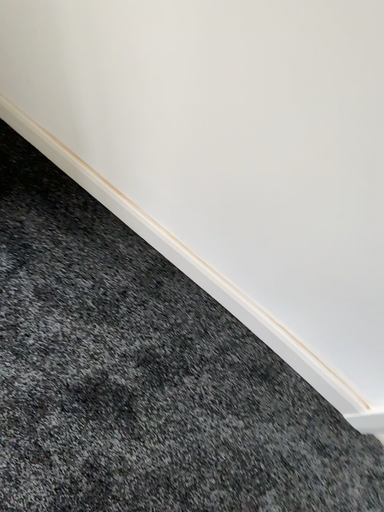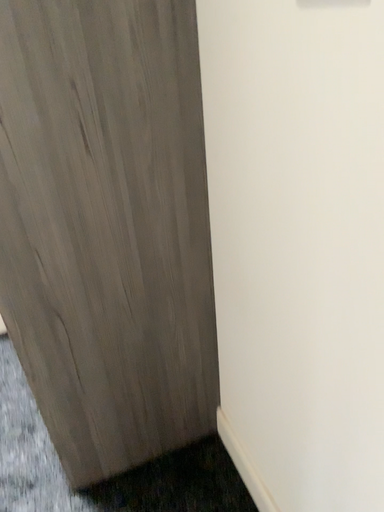
Question: How did the camera likely rotate when shooting the video?

Choices:
 (A) rotated downward
 (B) rotated upward

Answer: (B)